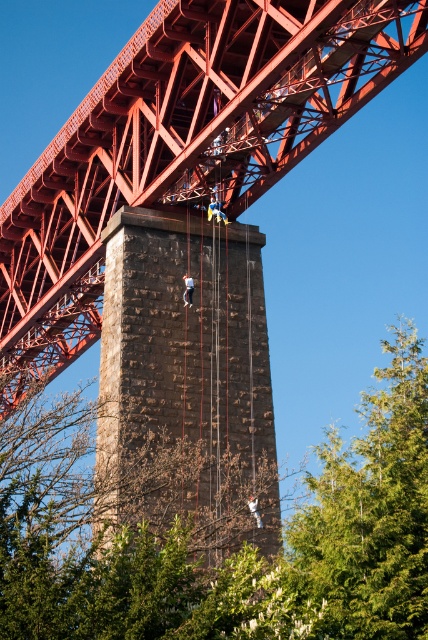
Question: Does red painted steel bridge at upper center appear on the left side of brown rough stone tower at center?

Choices:
 (A) no
 (B) yes

Answer: (B)

Question: Among these points, which one is farthest from the camera?

Choices:
 (A) pyautogui.click(x=238, y=108)
 (B) pyautogui.click(x=80, y=477)

Answer: (B)

Question: Is green leafy tree at center positioned behind brown rough stone tower at center?

Choices:
 (A) yes
 (B) no

Answer: (B)

Question: Which of the following is the farthest from the observer?

Choices:
 (A) (163, 378)
 (B) (2, 355)
 (C) (3, 563)

Answer: (B)

Question: Does red painted steel bridge at upper center lie behind green leafy tree at center?

Choices:
 (A) yes
 (B) no

Answer: (A)

Question: Which of the following is the closest to the observer?

Choices:
 (A) red painted steel bridge at upper center
 (B) green leafy tree at center
 (C) brown rough stone tower at center

Answer: (B)